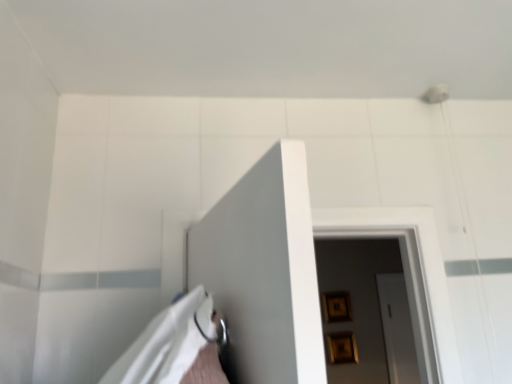
Question: Should I look upward or downward to see wooden picture frame at center, positioned as the 2th picture frame in top-to-bottom order?

Choices:
 (A) down
 (B) up

Answer: (A)

Question: Which direction should I rotate to look at gold metallic picture frame at upper center, the 2th picture frame positioned from the bottom, — up or down?

Choices:
 (A) down
 (B) up

Answer: (A)

Question: From a real-world perspective, is wooden picture frame at center, positioned as the 2th picture frame in top-to-bottom order, physically above gold metallic picture frame at upper center, the 2th picture frame positioned from the bottom?

Choices:
 (A) yes
 (B) no

Answer: (B)

Question: Is wooden picture frame at center, the 1th picture frame in the bottom-to-top sequence, in front of gold metallic picture frame at upper center, the 1th picture frame from the top?

Choices:
 (A) no
 (B) yes

Answer: (B)

Question: Is wooden picture frame at center, the 1th picture frame in the bottom-to-top sequence, outside gold metallic picture frame at upper center, the 1th picture frame from the top?

Choices:
 (A) no
 (B) yes

Answer: (B)

Question: From the image's perspective, is wooden picture frame at center, the 1th picture frame in the bottom-to-top sequence, on top of gold metallic picture frame at upper center, the 2th picture frame positioned from the bottom?

Choices:
 (A) no
 (B) yes

Answer: (A)

Question: Considering the relative sizes of wooden picture frame at center, the 1th picture frame in the bottom-to-top sequence, and gold metallic picture frame at upper center, the 2th picture frame positioned from the bottom, in the image provided, is wooden picture frame at center, the 1th picture frame in the bottom-to-top sequence, smaller than gold metallic picture frame at upper center, the 2th picture frame positioned from the bottom,?

Choices:
 (A) yes
 (B) no

Answer: (B)

Question: From the image's perspective, is wooden picture frame at center, positioned as the 2th picture frame in top-to-bottom order, under gold metallic picture frame at upper center, the 1th picture frame from the top?

Choices:
 (A) no
 (B) yes

Answer: (B)

Question: Does gold metallic picture frame at upper center, the 2th picture frame positioned from the bottom, have a lesser width compared to wooden picture frame at center, the 1th picture frame in the bottom-to-top sequence?

Choices:
 (A) yes
 (B) no

Answer: (A)

Question: Is gold metallic picture frame at upper center, the 2th picture frame positioned from the bottom, at the right side of wooden picture frame at center, the 1th picture frame in the bottom-to-top sequence?

Choices:
 (A) no
 (B) yes

Answer: (A)

Question: Is gold metallic picture frame at upper center, the 2th picture frame positioned from the bottom, completely or partially outside of wooden picture frame at center, the 1th picture frame in the bottom-to-top sequence?

Choices:
 (A) no
 (B) yes

Answer: (B)

Question: Can you confirm if gold metallic picture frame at upper center, the 2th picture frame positioned from the bottom, is smaller than wooden picture frame at center, positioned as the 2th picture frame in top-to-bottom order?

Choices:
 (A) yes
 (B) no

Answer: (A)

Question: Is gold metallic picture frame at upper center, the 1th picture frame from the top, positioned far away from wooden picture frame at center, positioned as the 2th picture frame in top-to-bottom order?

Choices:
 (A) yes
 (B) no

Answer: (B)

Question: Is gold metallic picture frame at upper center, the 2th picture frame positioned from the bottom, taller than wooden picture frame at center, the 1th picture frame in the bottom-to-top sequence?

Choices:
 (A) yes
 (B) no

Answer: (A)

Question: In the image, is wooden picture frame at center, the 1th picture frame in the bottom-to-top sequence, positioned in front of or behind gold metallic picture frame at upper center, the 2th picture frame positioned from the bottom?

Choices:
 (A) front
 (B) behind

Answer: (A)